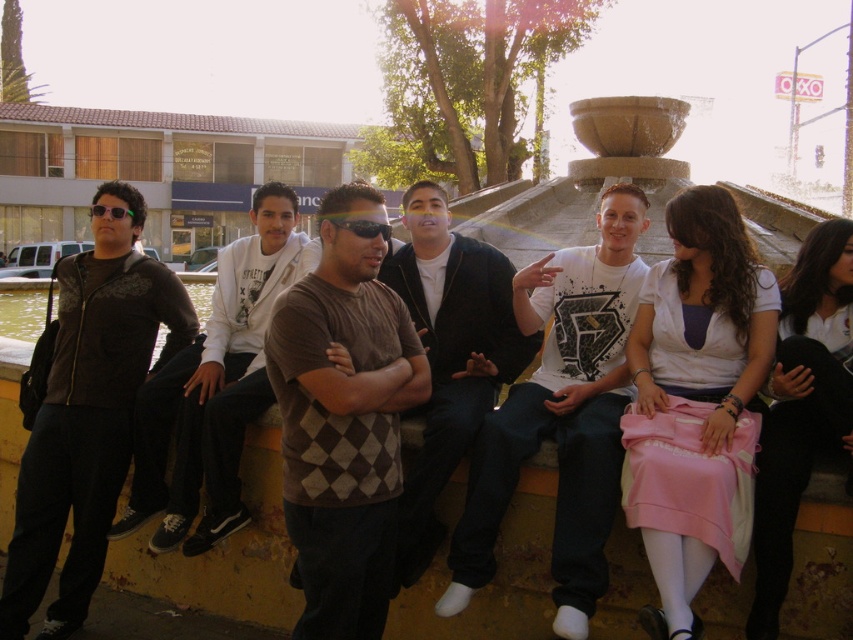
Question: Is dark gray zip-up hoodie at left thinner than dark gray argyle sweater at center?

Choices:
 (A) no
 (B) yes

Answer: (A)

Question: From the image, what is the correct spatial relationship of white matte t-shirt at center in relation to matte black sunglasses at center?

Choices:
 (A) left
 (B) right

Answer: (B)

Question: Which point is closer to the camera?

Choices:
 (A) brown argyle sweater at center
 (B) matte black sunglasses at center
 (C) dark gray argyle sweater at center

Answer: (B)

Question: Does brown argyle sweater at center appear over dark gray argyle sweater at center?

Choices:
 (A) yes
 (B) no

Answer: (A)

Question: Which point is closer to the camera?

Choices:
 (A) (456, 355)
 (B) (380, 224)
 (C) (67, 404)

Answer: (B)

Question: Which of the following is the farthest from the observer?

Choices:
 (A) argyle sweater at center
 (B) dark gray zip-up hoodie at left
 (C) brown argyle sweater at center

Answer: (C)